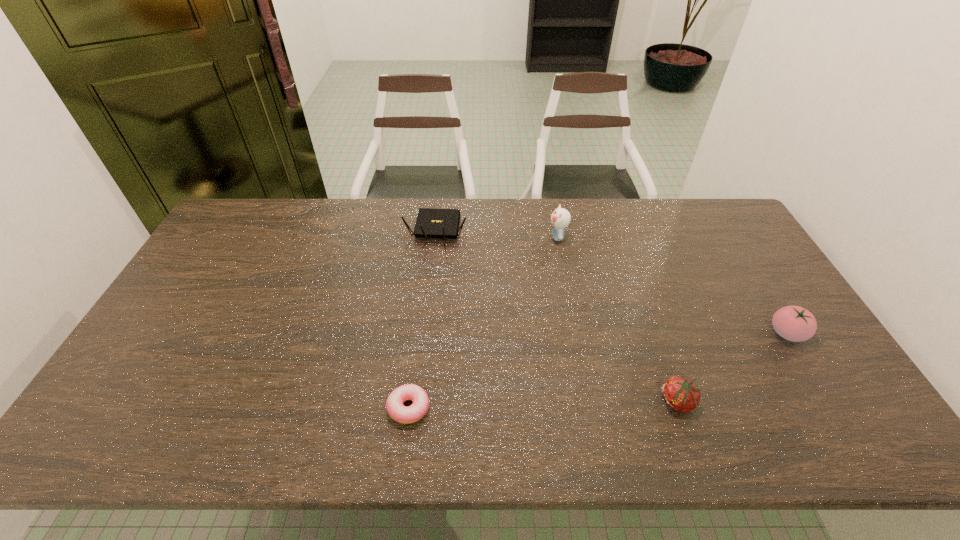
This screenshot has width=960, height=540. In order to click on free space at the far edge in this screenshot , I will do `click(529, 217)`.

At what (x,y) coordinates should I click in order to perform the action: click on free spot at the left edge of the desktop. Please return your answer as a coordinate pair (x, y). Image resolution: width=960 pixels, height=540 pixels. Looking at the image, I should click on (124, 377).

This screenshot has width=960, height=540. I want to click on free location at the right edge, so [765, 298].

Find the location of a particular element. The height and width of the screenshot is (540, 960). vacant area at the far left corner of the desktop is located at coordinates (270, 226).

In the image, there is a desktop. Identify the location of vacant region at the far right corner. This screenshot has height=540, width=960. (719, 232).

In the image, there is a desktop. Identify the location of vacant space at the near right corner. The image size is (960, 540). (853, 441).

Find the location of `vacant area that lies between the doughnut and the router`. vacant area that lies between the doughnut and the router is located at coordinates (422, 319).

Locate an element on the screen. vacant area between the router and the rightmost object is located at coordinates (612, 281).

I want to click on blank region between the doughnut and the tallest object, so click(483, 322).

Find the location of a particular element. Image resolution: width=960 pixels, height=540 pixels. unoccupied position between the fourth tallest object and the third farthest object is located at coordinates (732, 368).